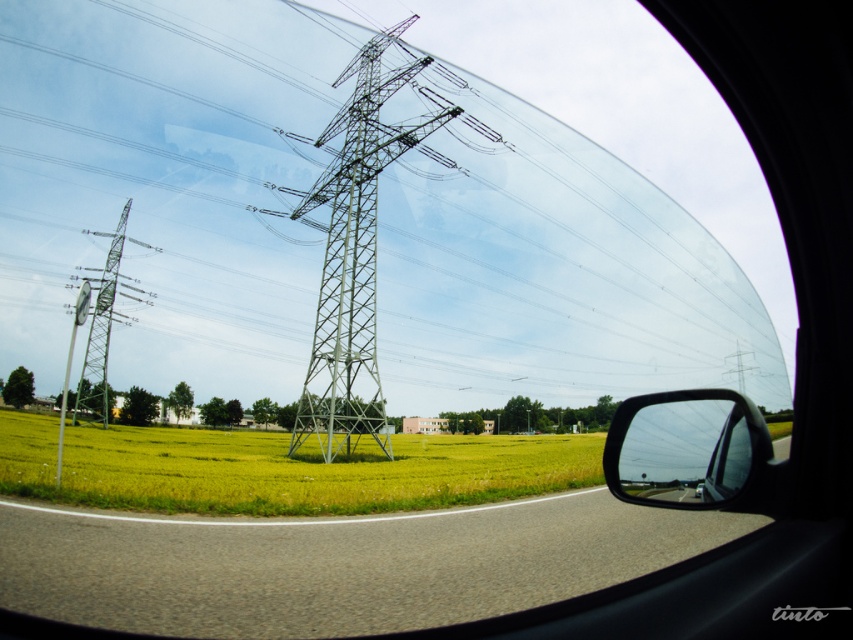
You are driving and need to check your blind spot. You have a green metallic tower at center and a shiny black mirror at right in your view. Which object is closer to the right edge of your side window?

The shiny black mirror at right is closer to the right edge of your side window since the green metallic tower at center is to the left of it.

You are a passenger in the vehicle and looking out the window. You notice a point marked at coordinates (280, 468). Based on the scene, what does this point most likely represent?

The point at (280, 468) corresponds to the green grassy field at center, which is part of the vast golden yellow fields in the middle ground of the scene.